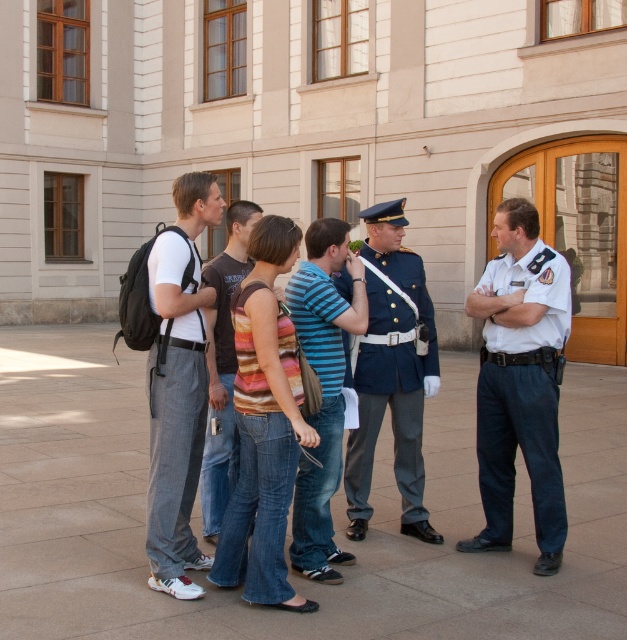
Which of these two, blue uniform at center or striped shirt at center, stands shorter?

Standing shorter between the two is striped shirt at center.

Who is positioned more to the left, blue uniform at center or striped shirt at center?

striped shirt at center

In the scene shown: Measure the distance between blue uniform at center and camera.

They are 4.92 meters apart.

Where is `blue uniform at center`? The height and width of the screenshot is (640, 627). blue uniform at center is located at coordinates (391, 372).

Who is more forward, (552, 529) or (393, 346)?

Positioned in front is point (552, 529).

Between white uniform at center and blue uniform at center, which one appears on the right side from the viewer's perspective?

white uniform at center is more to the right.

Locate an element on the screen. The height and width of the screenshot is (640, 627). white uniform at center is located at coordinates (520, 381).

Find the location of `matte gray pants at left`. matte gray pants at left is located at coordinates (177, 387).

What do you see at coordinates (177, 387) in the screenshot? I see `matte gray pants at left` at bounding box center [177, 387].

The width and height of the screenshot is (627, 640). Describe the element at coordinates (177, 387) in the screenshot. I see `matte gray pants at left` at that location.

Locate an element on the screen. The image size is (627, 640). matte gray pants at left is located at coordinates (177, 387).